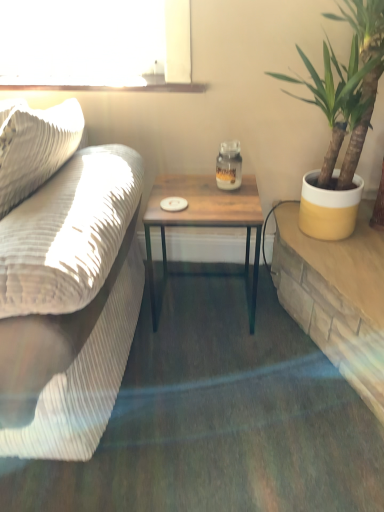
This screenshot has width=384, height=512. I want to click on free space above wooden table at center (from a real-world perspective), so click(x=198, y=197).